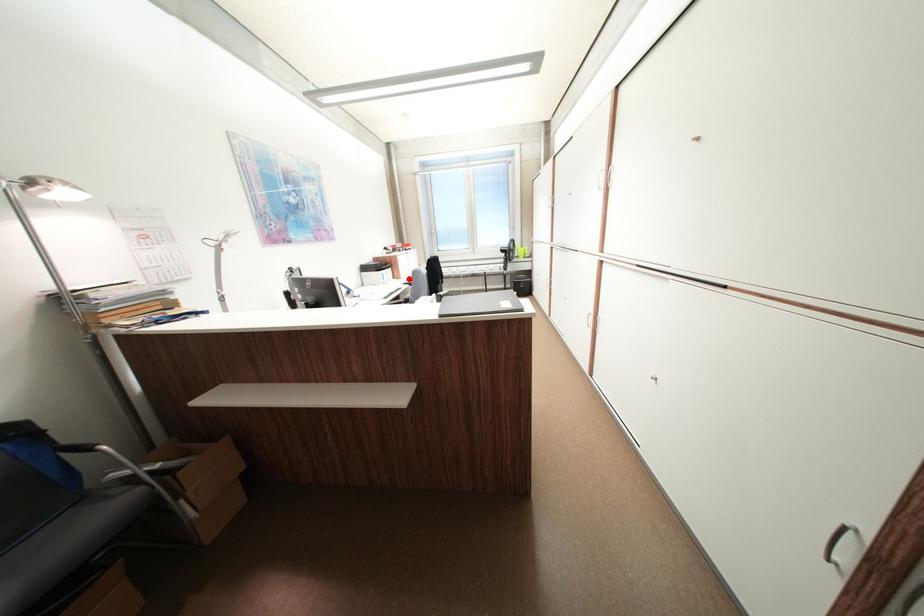
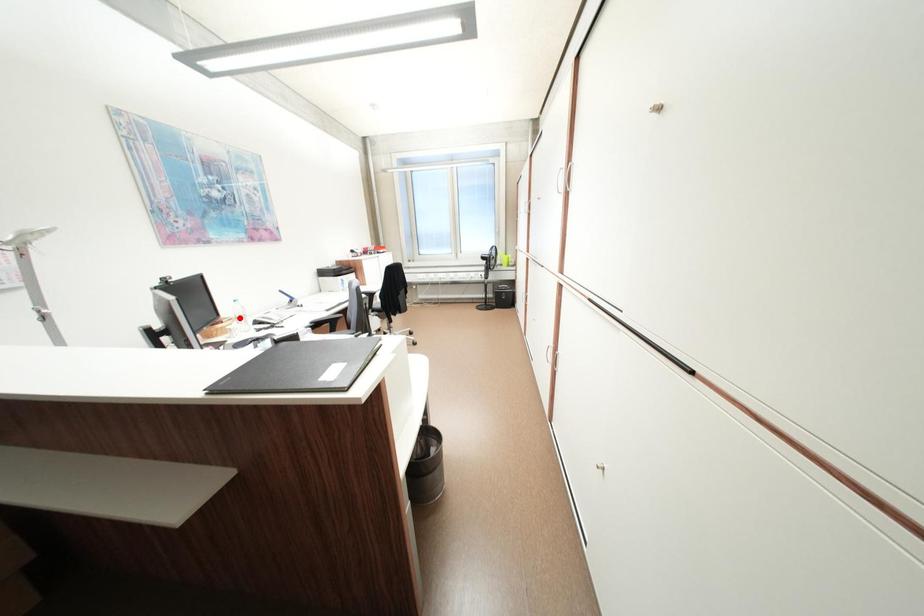
I am providing you with two images of the same scene from different viewpoints. A red point is marked on the first image and another point is marked on the second image. Does the point marked in image1 correspond to the same location as the one in image2?

No